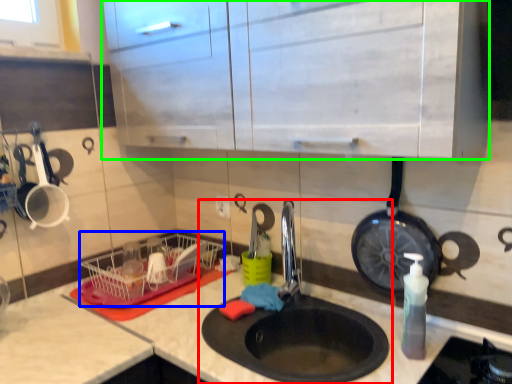
Question: Which object is positioned closest to sink (highlighted by a red box)? Select from basket (highlighted by a blue box) and cabinetry (highlighted by a green box).

Choices:
 (A) basket
 (B) cabinetry

Answer: (A)